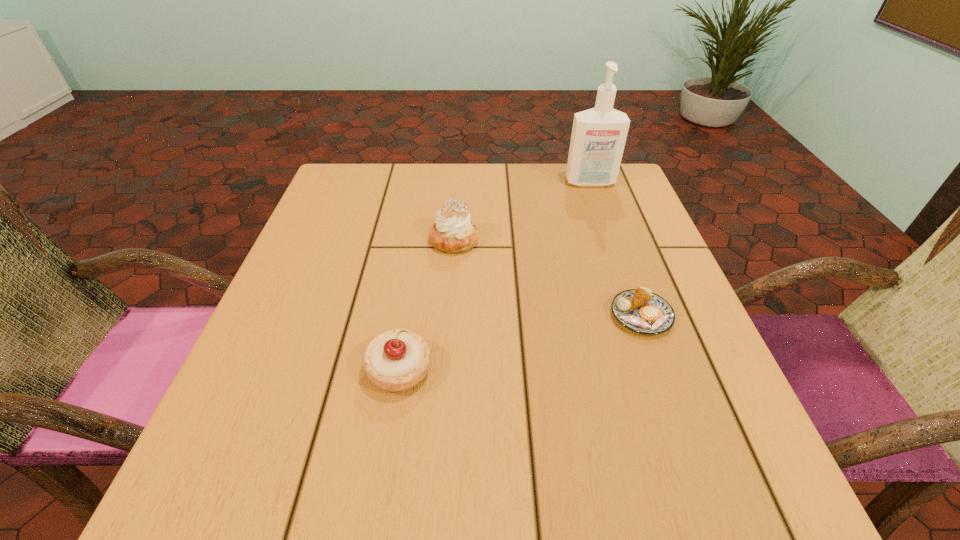
Where is `free region located 0.150m on the left of the second shortest object`? This screenshot has height=540, width=960. free region located 0.150m on the left of the second shortest object is located at coordinates (274, 370).

Locate an element on the screen. This screenshot has width=960, height=540. blank area located 0.130m on the left of the shortest pastry is located at coordinates (539, 316).

Identify the location of object that is at the far edge. (598, 137).

This screenshot has height=540, width=960. I want to click on cleansing agent present at the right edge, so click(x=598, y=137).

Image resolution: width=960 pixels, height=540 pixels. What are the coordinates of `pastry located at the right edge` in the screenshot? It's located at (640, 310).

At what (x,y) coordinates should I click in order to perform the action: click on object at the far right corner. Please return your answer as a coordinate pair (x, y). This screenshot has width=960, height=540. Looking at the image, I should click on (598, 137).

Where is `vacant space at the far edge of the desktop`? Image resolution: width=960 pixels, height=540 pixels. vacant space at the far edge of the desktop is located at coordinates (499, 208).

You are a GUI agent. You are given a task and a screenshot of the screen. Output one action in this format:
    pyautogui.click(x=<x>, y=<y>)
    Task: Click on the free space at the near edge of the desktop
    This screenshot has width=960, height=540.
    Given the screenshot: What is the action you would take?
    [x=344, y=467]

Find the location of a particular element. vacant space at the left edge of the desktop is located at coordinates (301, 421).

I want to click on free space at the right edge of the desktop, so [x=610, y=242].